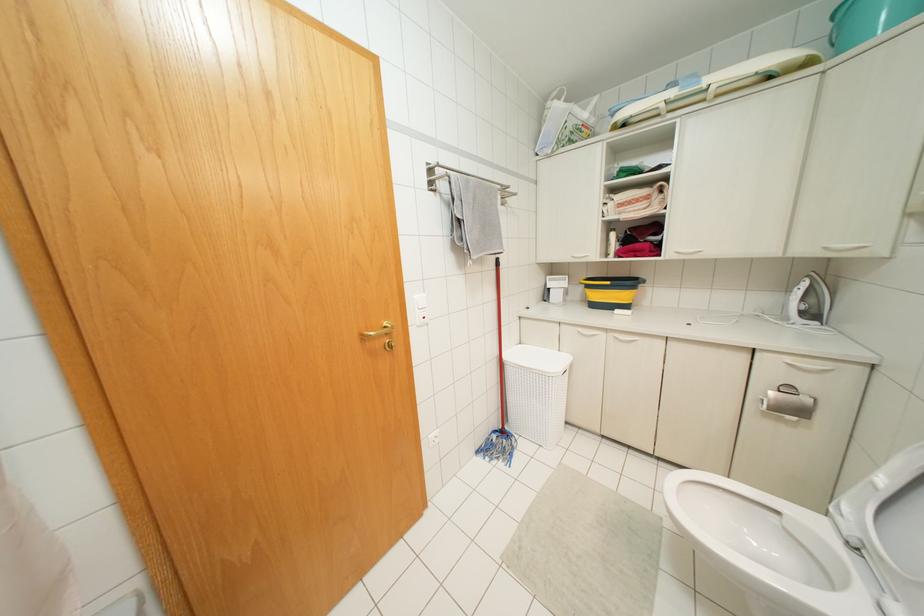
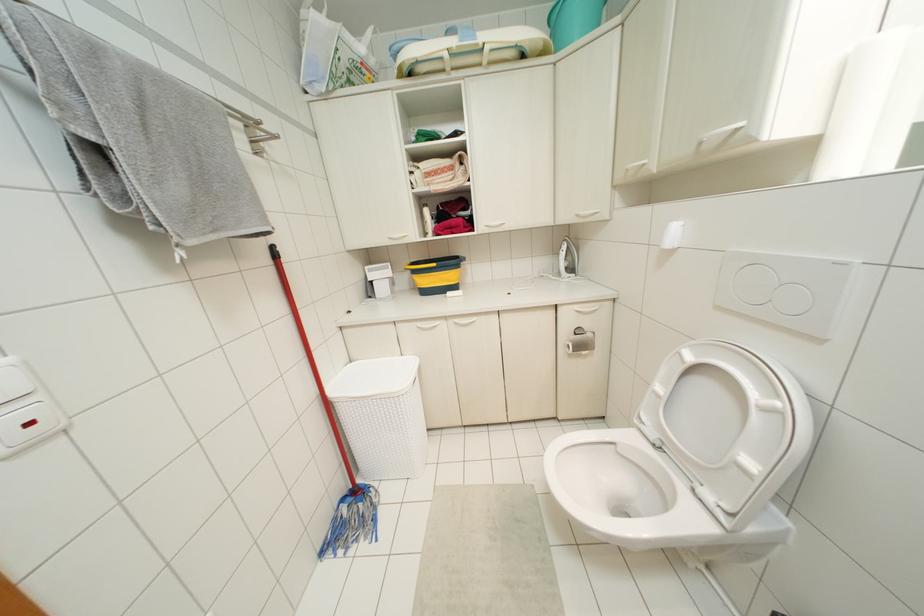
In the second image, find the point that corresponds to point 806,399 in the first image.

(589, 334)